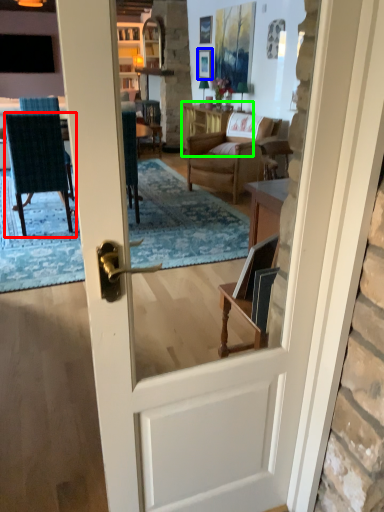
Question: Which is nearer to the chair (highlighted by a red box)? picture frame (highlighted by a blue box) or table (highlighted by a green box).

Choices:
 (A) picture frame
 (B) table

Answer: (B)